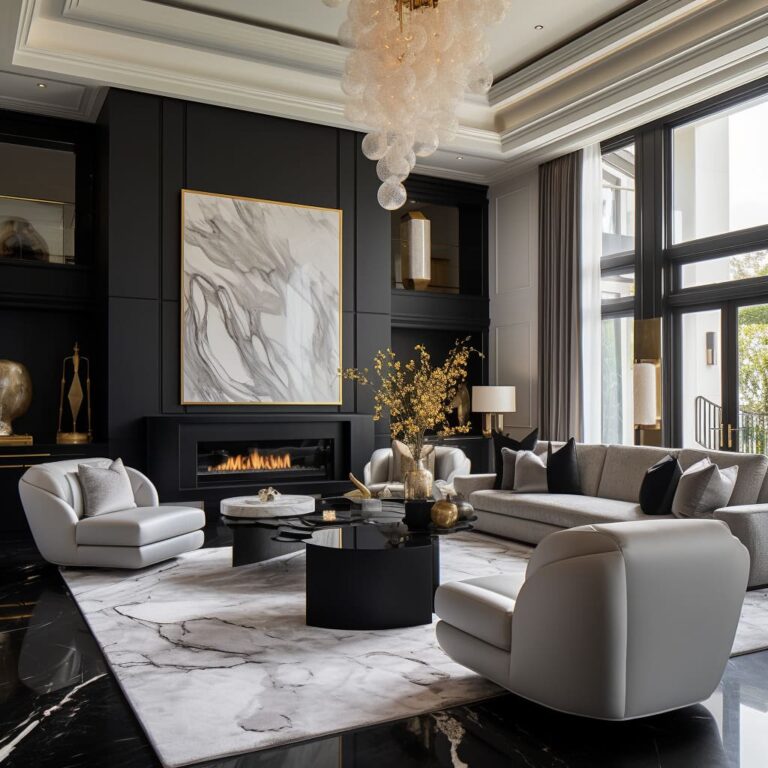
This screenshot has height=768, width=768. I want to click on couch, so click(x=588, y=491).